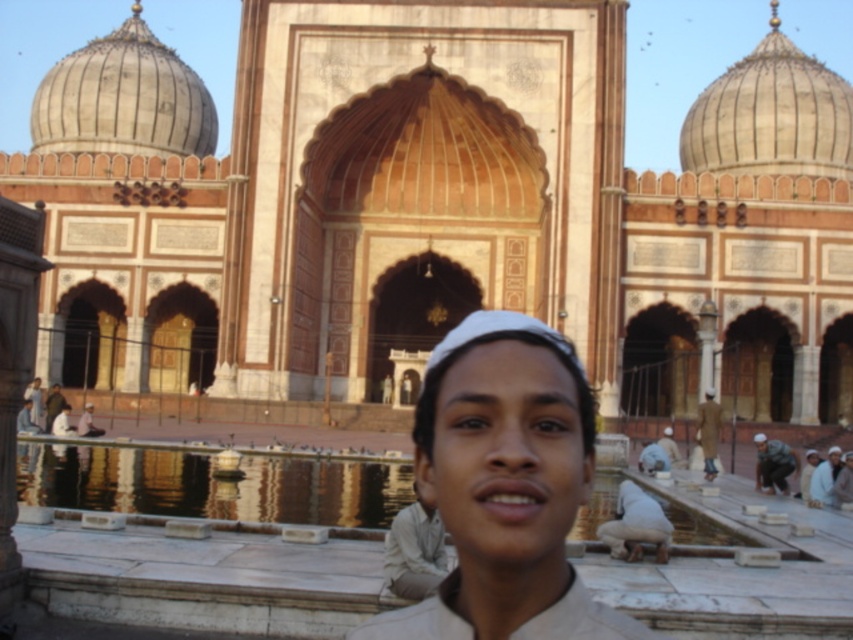
You are a visitor at the mosque and see the matte beige shirt at center and the matte white cap at center. Which one is positioned to the left from your perspective?

The matte beige shirt at center is to the left of the matte white cap at center, so the matte beige shirt at center is positioned to the left.